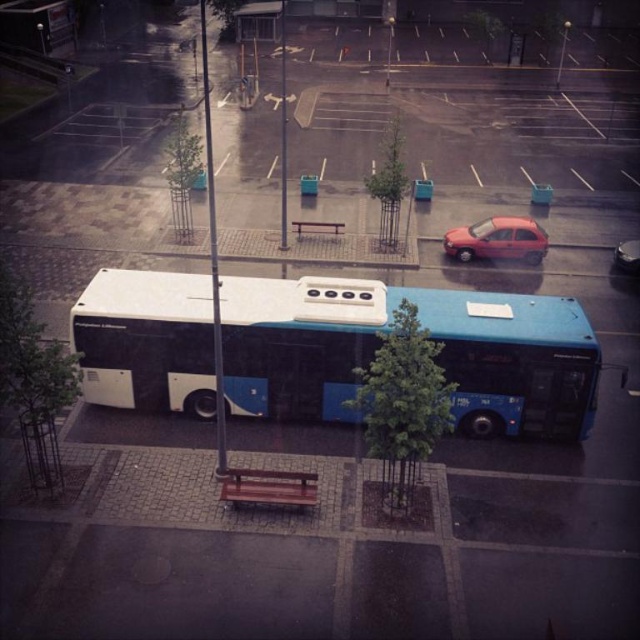
Question: Is the position of wooden park bench at center more distant than that of brown wooden bench at center?

Choices:
 (A) no
 (B) yes

Answer: (A)

Question: Among these objects, which one is farthest from the camera?

Choices:
 (A) blue matte bus at center
 (B) shiny red car at center right

Answer: (B)

Question: Observing the image, what is the correct spatial positioning of shiny red car at center right in reference to brown wooden bench at center?

Choices:
 (A) left
 (B) right

Answer: (B)

Question: Which object is closer to the camera taking this photo?

Choices:
 (A) metallic red car at center
 (B) wooden park bench at center
 (C) shiny red car at center right

Answer: (B)

Question: Does shiny red car at center right have a smaller size compared to metallic red car at center?

Choices:
 (A) yes
 (B) no

Answer: (B)

Question: Which point appears farthest from the camera in this image?

Choices:
 (A) (637, 268)
 (B) (220, 496)
 (C) (522, 243)
 (D) (328, 224)

Answer: (D)